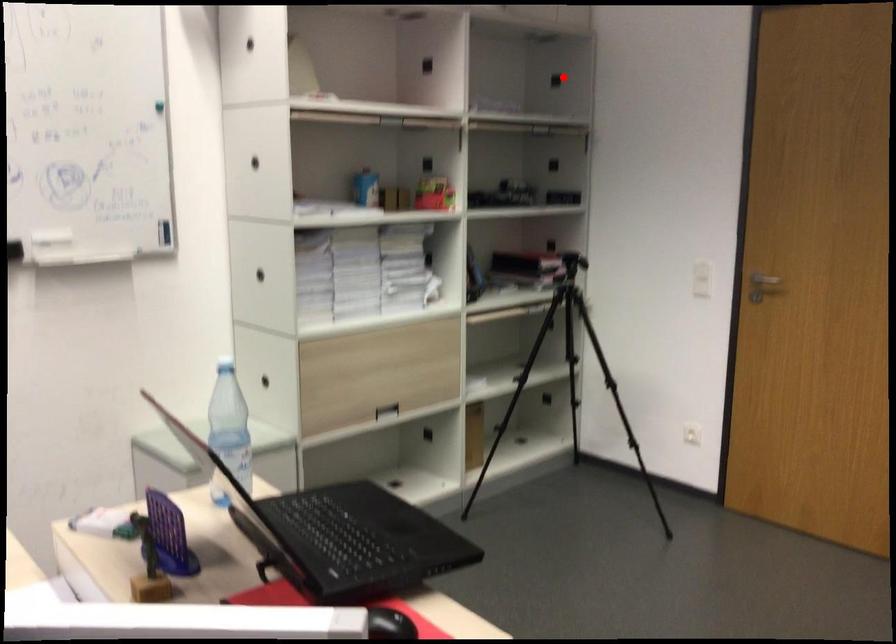
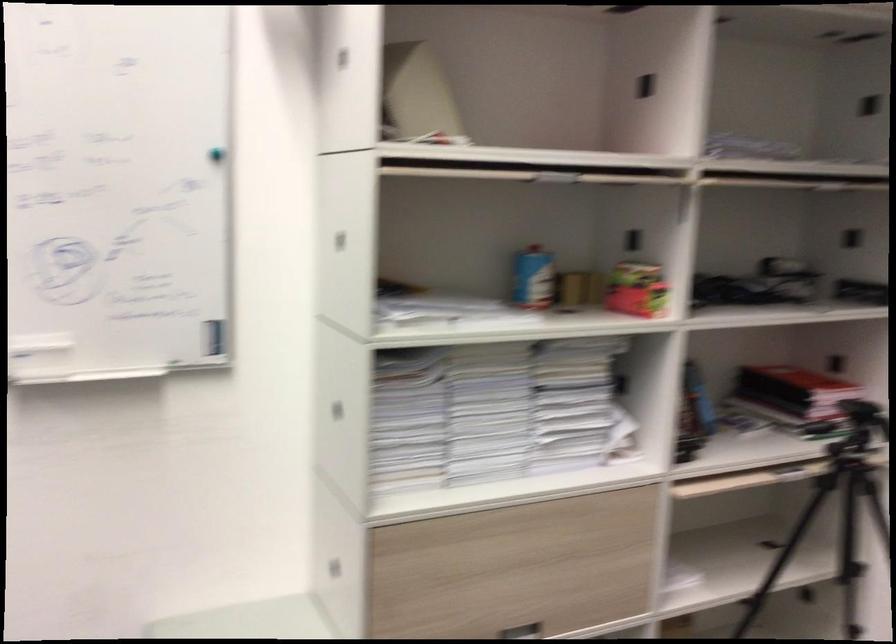
Question: I am providing you with two images of the same scene from different viewpoints. Image1 has a red point marked. In image2, the corresponding 3D location appears at what relative position? Reply with the corresponding letter.

Choices:
 (A) Closer
 (B) Farther

Answer: (A)